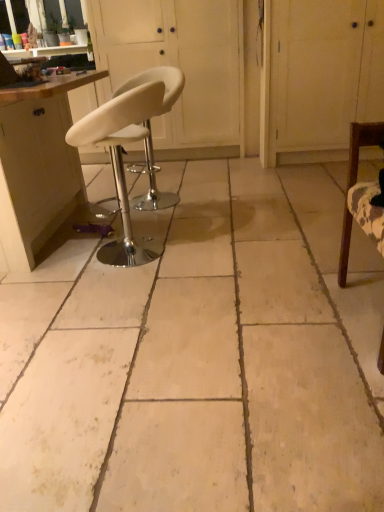
Identify the location of unoccupied area behind wooden chair at right, arranged as the 1th chair when viewed from the right. The image size is (384, 512). (315, 270).